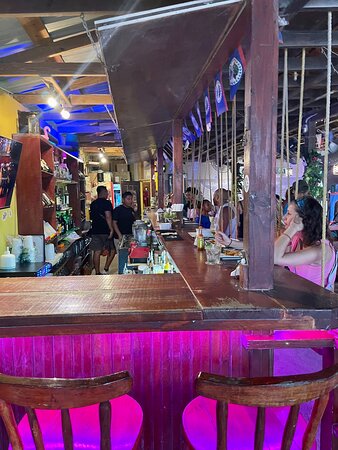
Locate an element on the screen. This screenshot has width=338, height=450. bottles of alcohol is located at coordinates (67, 197), (57, 201).